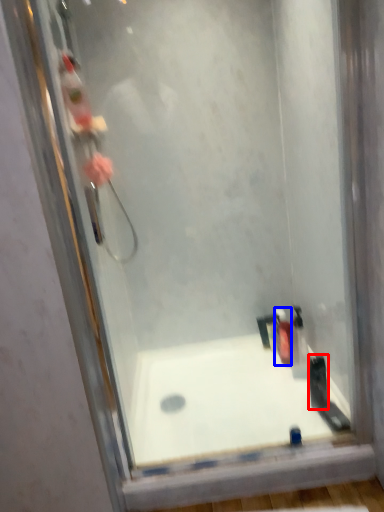
Question: Among these objects, which one is nearest to the camera, toiletry (highlighted by a red box) or toiletry (highlighted by a blue box)?

Choices:
 (A) toiletry
 (B) toiletry

Answer: (A)